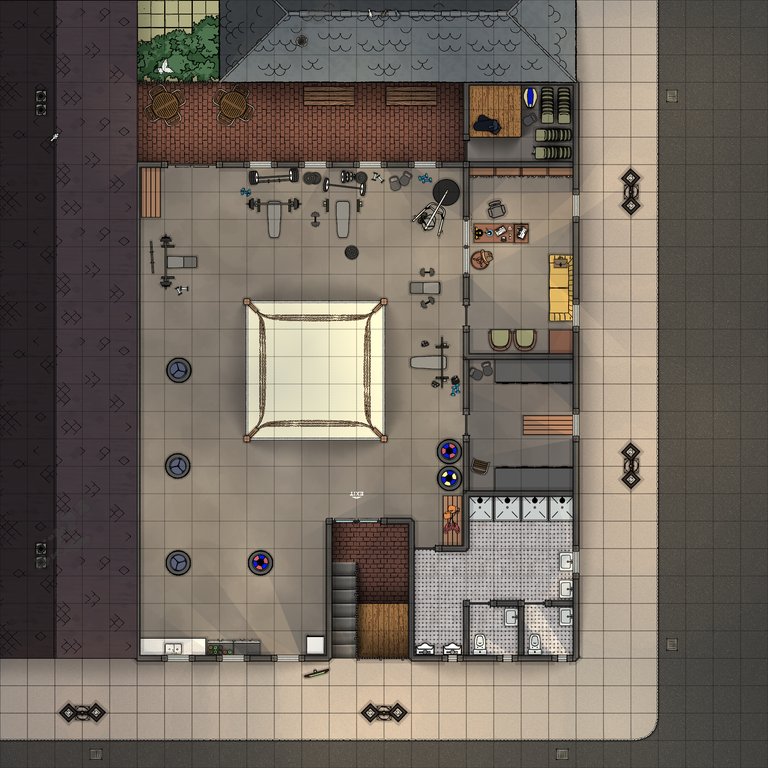
Identify the location of showers. The width and height of the screenshot is (768, 768). (558, 508), (540, 508), (510, 505), (480, 507).